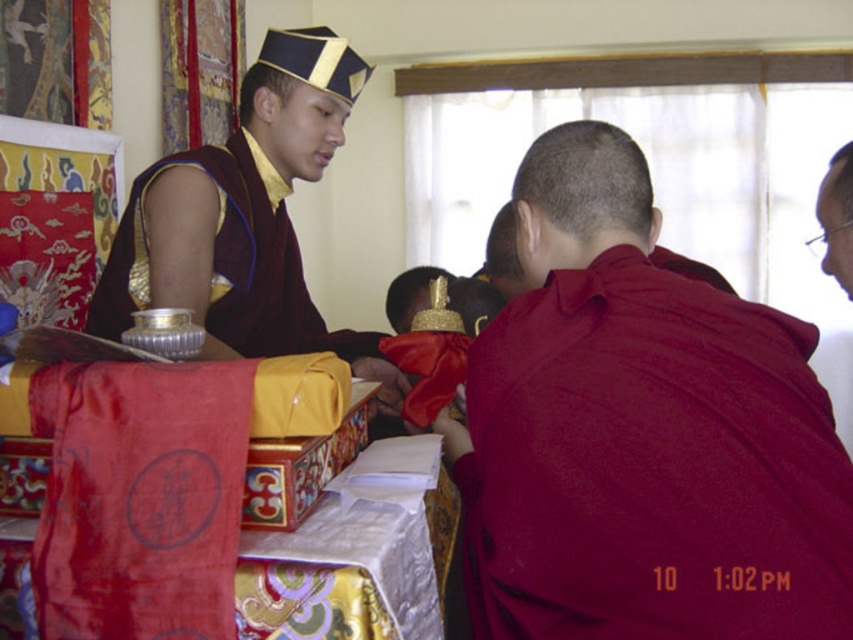
Question: From the image, what is the correct spatial relationship of smooth maroon robe at center in relation to smooth red robe at right?

Choices:
 (A) right
 (B) left

Answer: (B)

Question: Where is smooth maroon robe at center located in relation to maroon silk robe at center in the image?

Choices:
 (A) left
 (B) right

Answer: (B)

Question: Which object is farther from the camera taking this photo?

Choices:
 (A) maroon silk robe at center
 (B) silky red cloth at lower center
 (C) smooth maroon robe at center

Answer: (A)

Question: Which of the following is the farthest from the observer?

Choices:
 (A) (206, 550)
 (B) (233, 316)

Answer: (B)

Question: Which point appears farthest from the camera in this image?

Choices:
 (A) (68, 458)
 (B) (723, 580)
 (C) (233, 132)
 (D) (846, 177)

Answer: (C)

Question: Does smooth maroon robe at center come behind maroon silk robe at center?

Choices:
 (A) yes
 (B) no

Answer: (B)